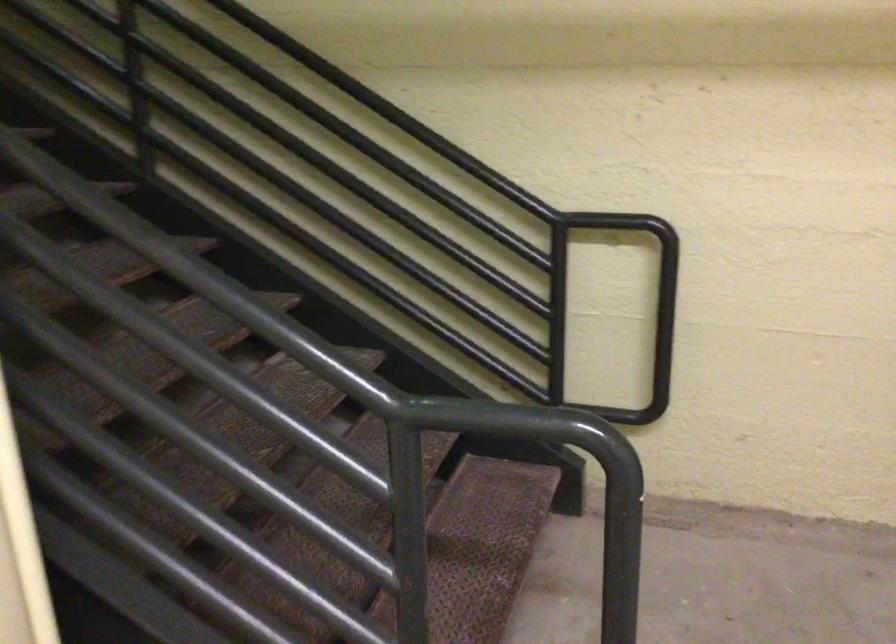
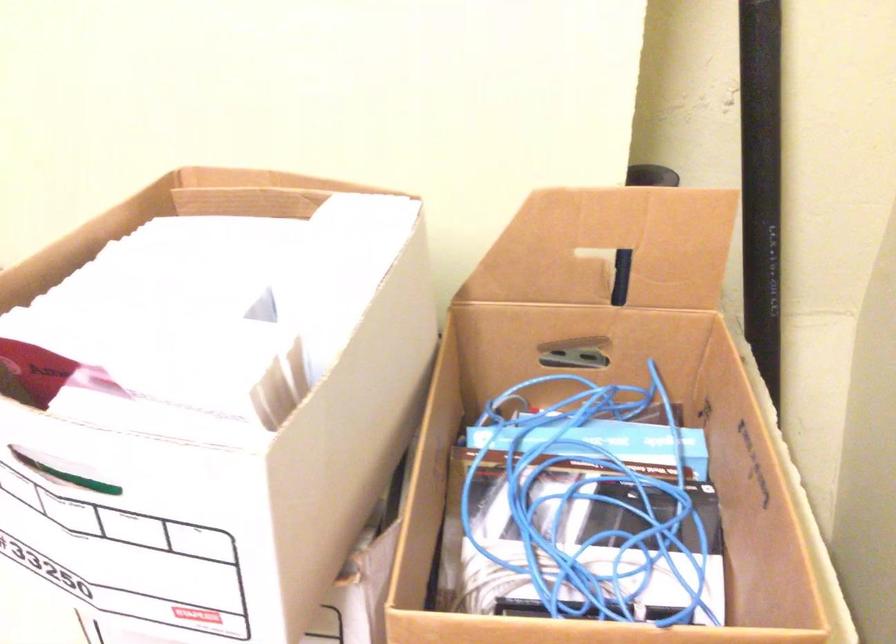
First-person continuous shooting, in which direction is the camera rotating?

The rotation direction of the camera is right-down.